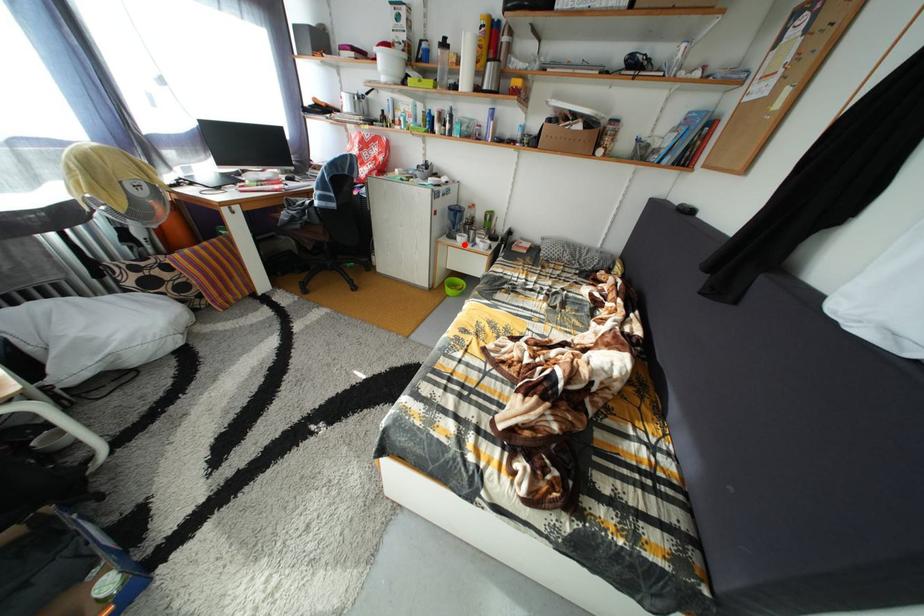
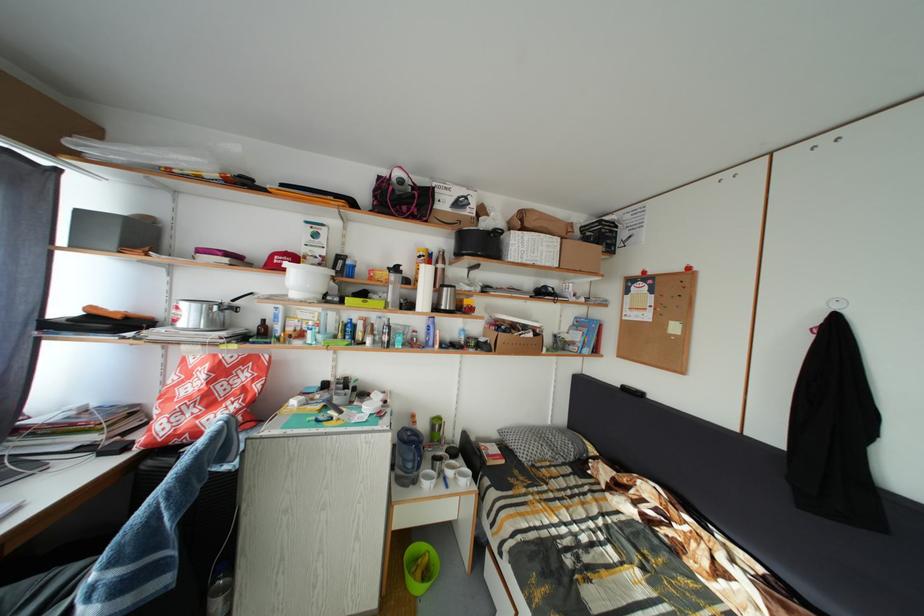
Question: I am providing you with two images of the same scene from different viewpoints. In image1, a red point is highlighted. Considering the same 3D point in image2, which of the following is correct?

Choices:
 (A) It is closer
 (B) It is farther

Answer: (B)